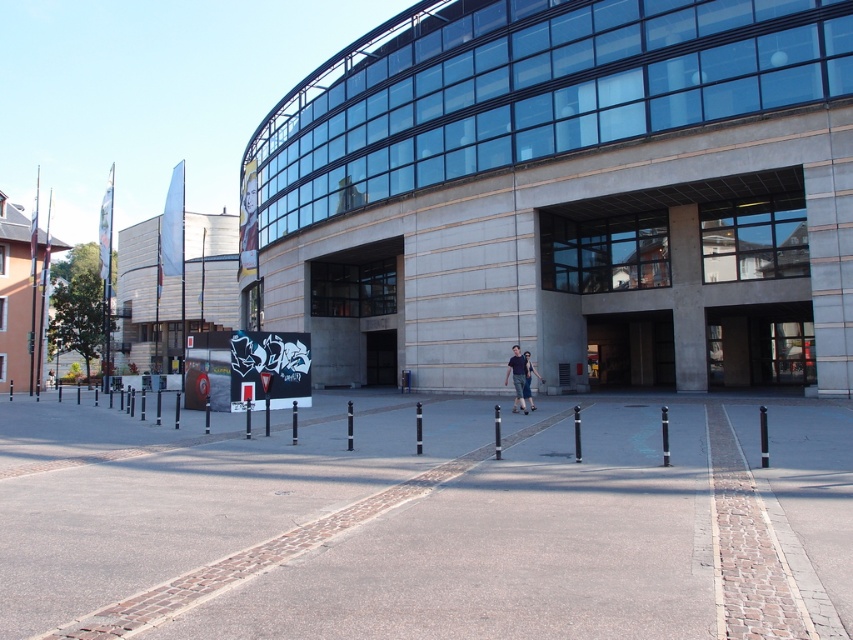
Can you confirm if denim pants at center is positioned below dark blue jeans at center?

Yes, denim pants at center is below dark blue jeans at center.

Does point (515, 365) come behind point (527, 358)?

Yes.

Which is in front, point (523, 401) or point (540, 376)?

Positioned in front is point (523, 401).

What are the coordinates of `denim pants at center` in the screenshot? It's located at (515, 378).